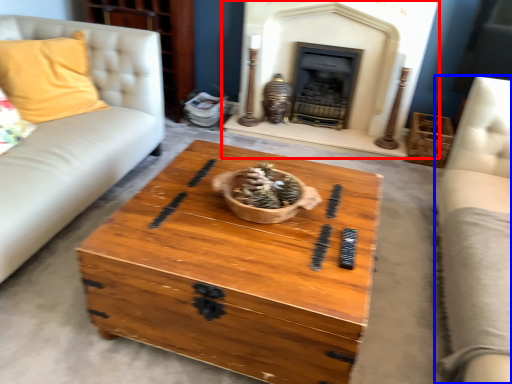
Question: Which point is closer to the camera, fireplace (highlighted by a red box) or couch (highlighted by a blue box)?

Choices:
 (A) fireplace
 (B) couch

Answer: (B)